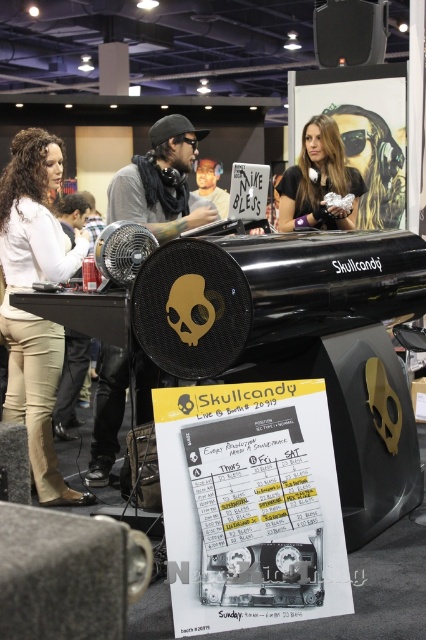
Is white paper poster at center smaller than black matte speaker at lower left?

Incorrect, white paper poster at center is not smaller in size than black matte speaker at lower left.

Between point (189, 584) and point (25, 570), which one is positioned behind?

Point (189, 584)

Locate an element on the screen. white paper poster at center is located at coordinates click(250, 506).

Is the position of white matte shirt at center less distant than that of matte black poster at upper center?

Yes, it is.

Can you confirm if white matte shirt at center is positioned below matte black poster at upper center?

Yes.

Does point (42, 224) come in front of point (333, 102)?

Yes.

This screenshot has height=640, width=426. Find the location of `white matte shirt at center`. white matte shirt at center is located at coordinates (31, 314).

Is white matte shirt at center thinner than matte black headphones at center?

Yes, white matte shirt at center is thinner than matte black headphones at center.

Find the location of a particular element. Image resolution: width=426 pixels, height=640 pixels. white matte shirt at center is located at coordinates (31, 314).